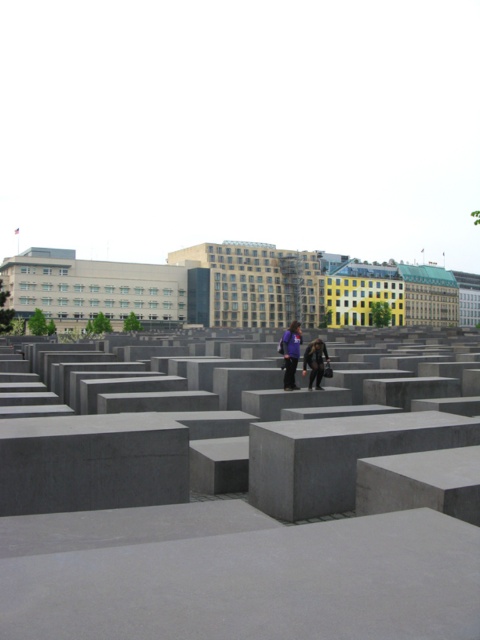
Question: Among these points, which one is nearest to the camera?

Choices:
 (A) (160, 525)
 (B) (284, 349)

Answer: (A)

Question: Which of the following is the closest to the observer?

Choices:
 (A) dark gray concrete blocks at center
 (B) gray concrete blocks at center
 (C) purple fabric jacket at center

Answer: (B)

Question: Which point is closer to the camera?

Choices:
 (A) purple fabric jacket at center
 (B) gray concrete blocks at center

Answer: (B)

Question: Is purple fabric jacket at center wider than dark gray concrete blocks at center?

Choices:
 (A) yes
 (B) no

Answer: (A)

Question: Can you confirm if gray concrete blocks at center is smaller than purple fabric jacket at center?

Choices:
 (A) no
 (B) yes

Answer: (A)

Question: Can you confirm if gray concrete blocks at center is positioned above dark gray concrete blocks at center?

Choices:
 (A) yes
 (B) no

Answer: (B)